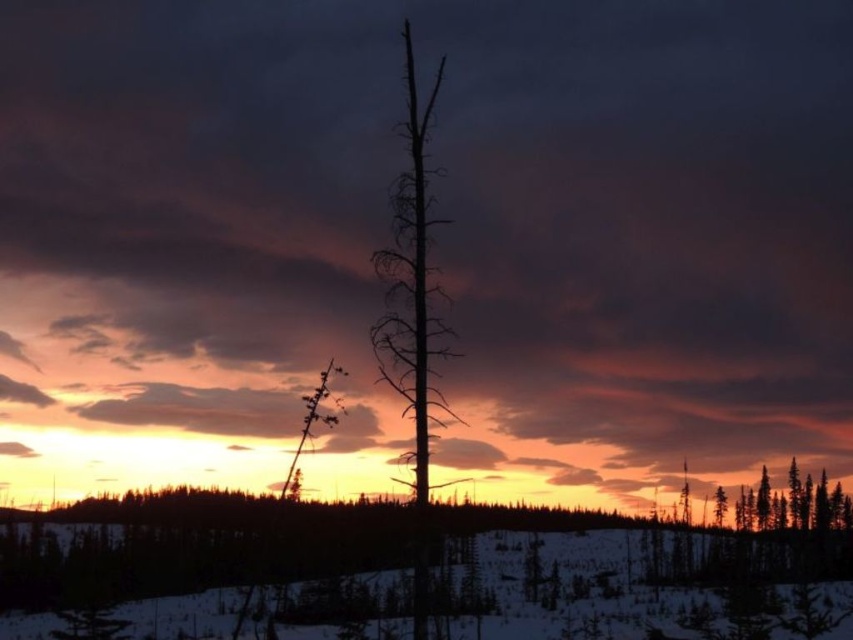
You are an artist trying to paint the winter landscape. You want to place a small red bird on the white matte snow at center so that it appears in front of the silhouette deadwood at center. Is this possible based on the current scene?

The white matte snow at center is further to the viewer than the silhouette deadwood at center. Therefore, placing the red bird on the white matte snow at center would position it in front of the silhouette deadwood at center, making it visible.

You are an artist painting this winter scene. You want to ensure the smooth brown tree trunk at right is properly positioned over the white matte snow at center. Based on the scene, is the trunk placed correctly?

Yes, the smooth brown tree trunk at right is correctly positioned over the white matte snow at center because the white matte snow at center is located below it.